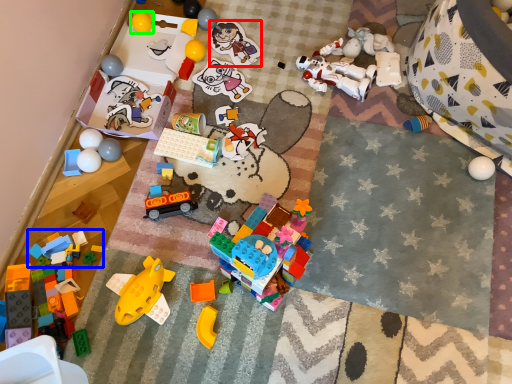
Question: Which object is the closest to the toy (highlighted by a red box)? Choose among these: toy (highlighted by a blue box) or toy (highlighted by a green box).

Choices:
 (A) toy
 (B) toy

Answer: (B)